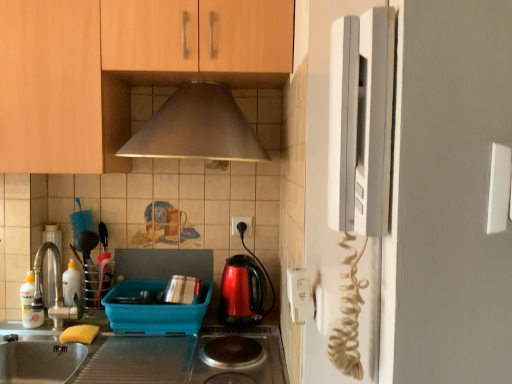
Question: Is the depth of satin steel sink at lower left greater than that of white plastic electric outlet at center, arranged as the first electric outlet when viewed from the left?

Choices:
 (A) yes
 (B) no

Answer: (B)

Question: From a real-world perspective, is satin steel sink at lower left located beneath white plastic electric outlet at center, which is counted as the 2th electric outlet, starting from the front?

Choices:
 (A) no
 (B) yes

Answer: (B)

Question: Is satin steel sink at lower left to the right of white plastic electric outlet at center, which is counted as the second electric outlet, starting from the right, from the viewer's perspective?

Choices:
 (A) no
 (B) yes

Answer: (A)

Question: Can you confirm if satin steel sink at lower left is shorter than white plastic electric outlet at center, arranged as the first electric outlet when viewed from the left?

Choices:
 (A) no
 (B) yes

Answer: (A)

Question: Can white plastic electric outlet at center, which is the 1th electric outlet from back to front, be found inside satin steel sink at lower left?

Choices:
 (A) yes
 (B) no

Answer: (B)

Question: In terms of size, does yellow sponge at lower left appear bigger or smaller than shiny plastic kettle at center?

Choices:
 (A) small
 (B) big

Answer: (A)

Question: Is yellow sponge at lower left wider or thinner than shiny plastic kettle at center?

Choices:
 (A) wide
 (B) thin

Answer: (B)

Question: From their relative heights in the image, would you say yellow sponge at lower left is taller or shorter than shiny plastic kettle at center?

Choices:
 (A) short
 (B) tall

Answer: (A)

Question: Which is correct: yellow sponge at lower left is inside shiny plastic kettle at center, or outside of it?

Choices:
 (A) outside
 (B) inside

Answer: (A)

Question: From the image's perspective, relative to satin steel sink at lower left, is shiny plastic kettle at center above or below?

Choices:
 (A) above
 (B) below

Answer: (A)

Question: Is shiny plastic kettle at center inside or outside of satin steel sink at lower left?

Choices:
 (A) inside
 (B) outside

Answer: (B)

Question: Considering the positions of shiny plastic kettle at center and satin steel sink at lower left in the image, is shiny plastic kettle at center wider or thinner than satin steel sink at lower left?

Choices:
 (A) wide
 (B) thin

Answer: (B)

Question: Considering their positions, is shiny plastic kettle at center located in front of or behind satin steel sink at lower left?

Choices:
 (A) behind
 (B) front

Answer: (A)

Question: From the image's perspective, relative to white plastic electric outlet at center, which is counted as the 2th electric outlet, starting from the front, is metallic utensil holder at left, acting as the 2th appliance starting from the right, above or below?

Choices:
 (A) above
 (B) below

Answer: (B)

Question: Is metallic utensil holder at left, the 2th appliance in the left-to-right sequence, in front of or behind white plastic electric outlet at center, which is counted as the second electric outlet, starting from the right, in the image?

Choices:
 (A) behind
 (B) front

Answer: (B)